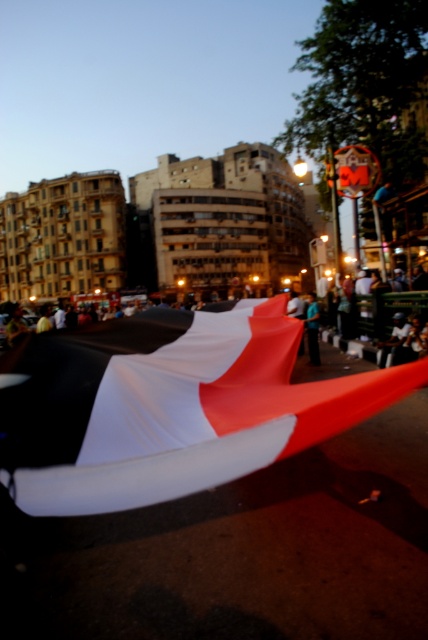
You are attending an event where you see a white matte flag at center and a blue fabric at center. Which object is positioned more to the left?

The white matte flag at center is positioned to the left of the blue fabric at center, so it is more to the left.

In the scene shown: You are a photographer standing in front of the scene described. You notice the white matte flag at center and the blue fabric at center. Which object is positioned closer to you?

The white matte flag at center is closer to the viewer than the blue fabric at center.

You are a photographer standing at the center of the scene. You want to capture a photo of the white matte flag at center. Where should you point your camera to ensure the flag is in the frame?

The white matte flag at center is located at the coordinates point (172, 406). To capture it in the frame, point your camera towards that coordinate position.